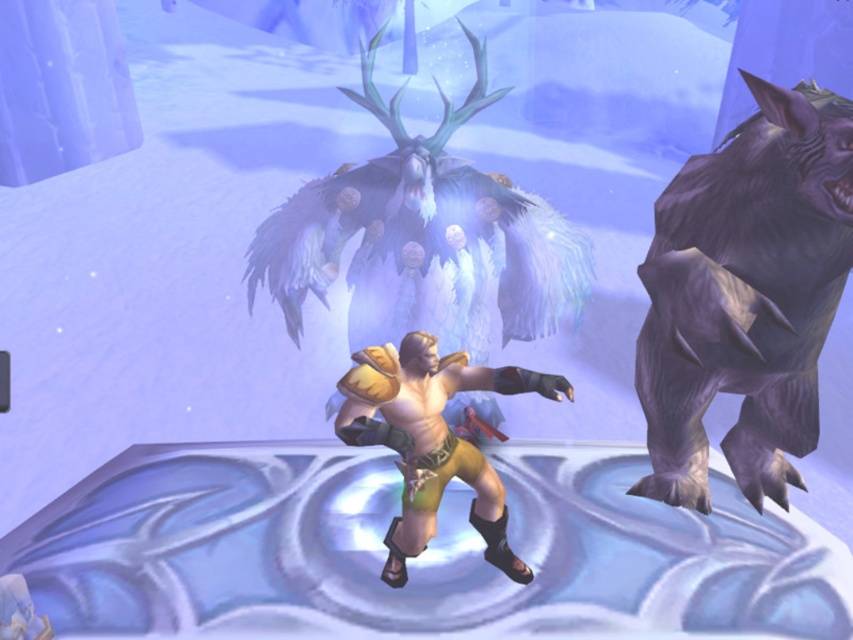
In the icy fantasy scene, you see a gray furry bear at right and a golden leather armor at center. Which object is taller?

The gray furry bear at right is much taller than the golden leather armor at center.

You are a warrior in the icy scene. You see the gray furry bear at right and the golden leather armor at center. Which object is closer to you?

The gray furry bear at right is closer to you because it is in front of the golden leather armor at center.

You are a warrior in the icy environment. You have to decide whether to engage the gray furry bear at right or retrieve the golden leather armor at center first. Based on their sizes, which one should you prioritize?

The gray furry bear at right is bigger than the golden leather armor at center, so you should prioritize engaging the bear first to ensure safety before retrieving the armor.